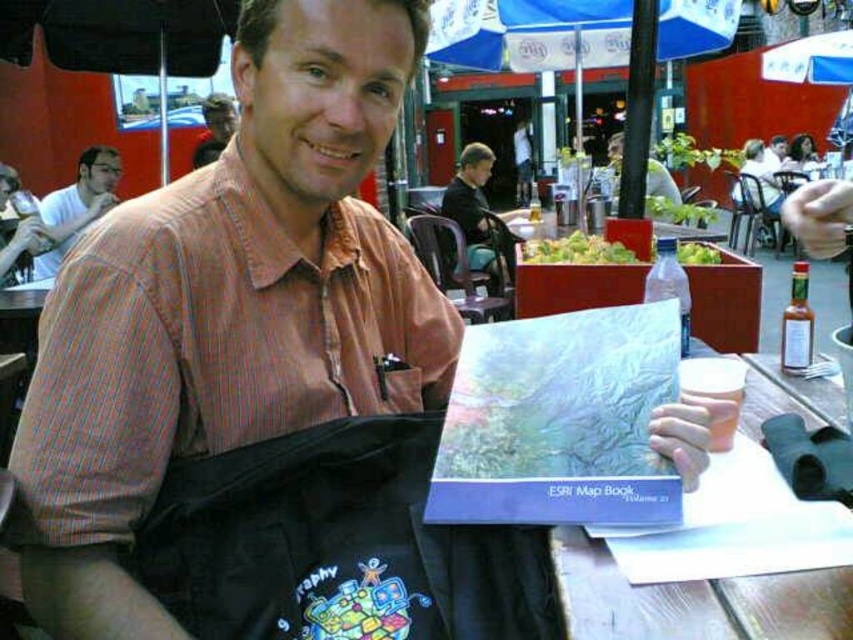
Question: Among these objects, which one is farthest from the camera?

Choices:
 (A) green leafy vegetables at center
 (B) smooth brown shirt at upper left

Answer: (B)

Question: Can you confirm if white paper at center is bigger than matte black shirt at upper left?

Choices:
 (A) yes
 (B) no

Answer: (B)

Question: Which object is farther from the camera taking this photo?

Choices:
 (A) green leafy vegetables at center
 (B) smooth brown shirt at upper left

Answer: (B)

Question: Is dark brown leather jacket at center thinner than matte orange shirt at center?

Choices:
 (A) no
 (B) yes

Answer: (A)

Question: Which object is farther from the camera taking this photo?

Choices:
 (A) matte black shirt at upper left
 (B) matte orange shirt at center

Answer: (B)

Question: Can you confirm if white paper at center is wider than dark brown leather jacket at center?

Choices:
 (A) yes
 (B) no

Answer: (B)